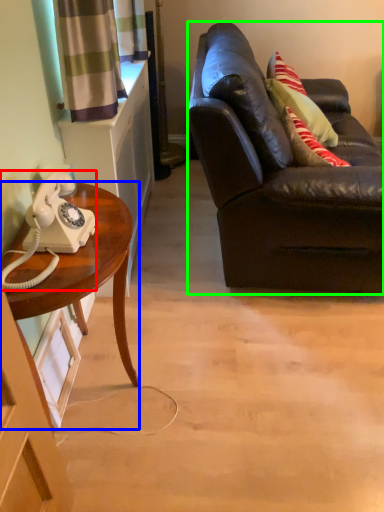
Question: Which object is positioned farthest from corded phone (highlighted by a red box)? Select from desk (highlighted by a blue box) and studio couch (highlighted by a green box).

Choices:
 (A) desk
 (B) studio couch

Answer: (B)